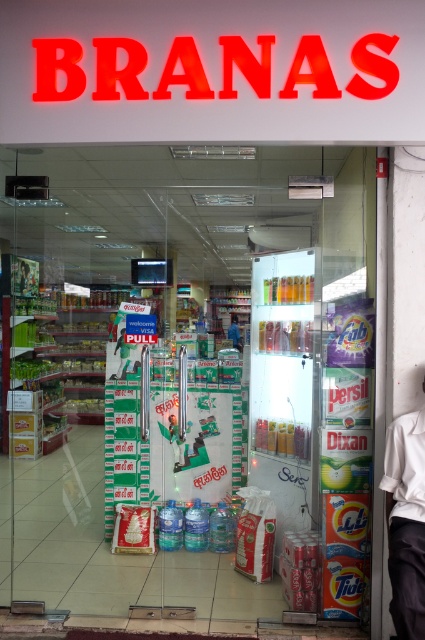
You are a delivery person trying to enter the store through the transparent plastic glass door at center. The blue fabric shirt at center is blocking your path. Can you walk through the door without moving the shirt?

The transparent plastic glass door at center is larger in size compared to blue fabric shirt at center, so yes, you can walk through the door without moving the shirt since the door is bigger and can accommodate both you and the shirt.

You are a delivery person with a cart that is 4 meters wide. You need to deliver a package to the store through the entrance. Can your cart fit through the space between the green and white promotional stand on the left and the transparent plastic glass door at center?

The space between the green and white promotional stand on the left and the transparent plastic glass door at center is 4.01 meters. Since the cart is 4 meters wide, it can fit through the space as the distance is slightly larger than the cart.

You are a delivery person trying to enter the BRANAS convenience store. You see the transparent plastic glass door at center and the blue fabric shirt at center. Which object is closer to you as you approach the store entrance?

The transparent plastic glass door at center is closer to you than the blue fabric shirt at center because it is in front of it.